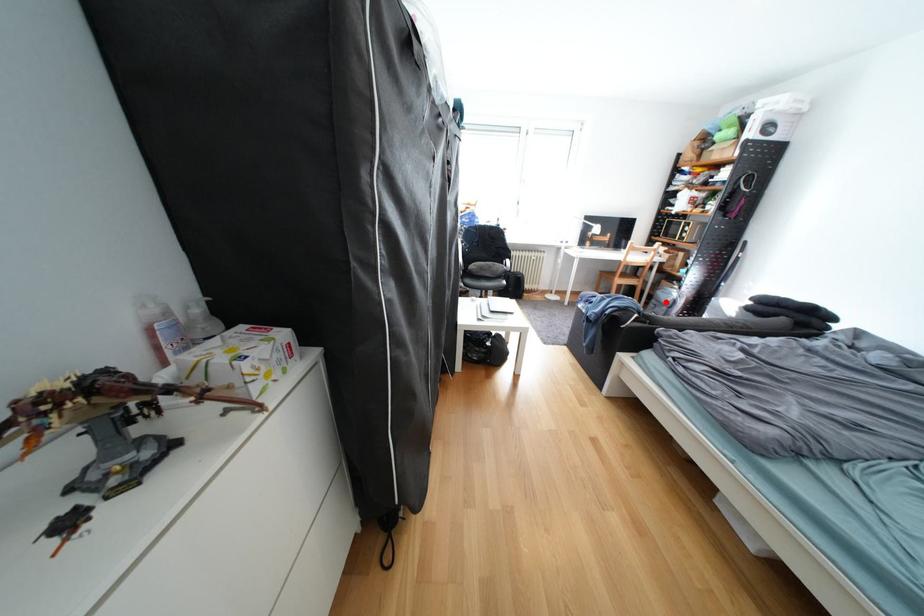
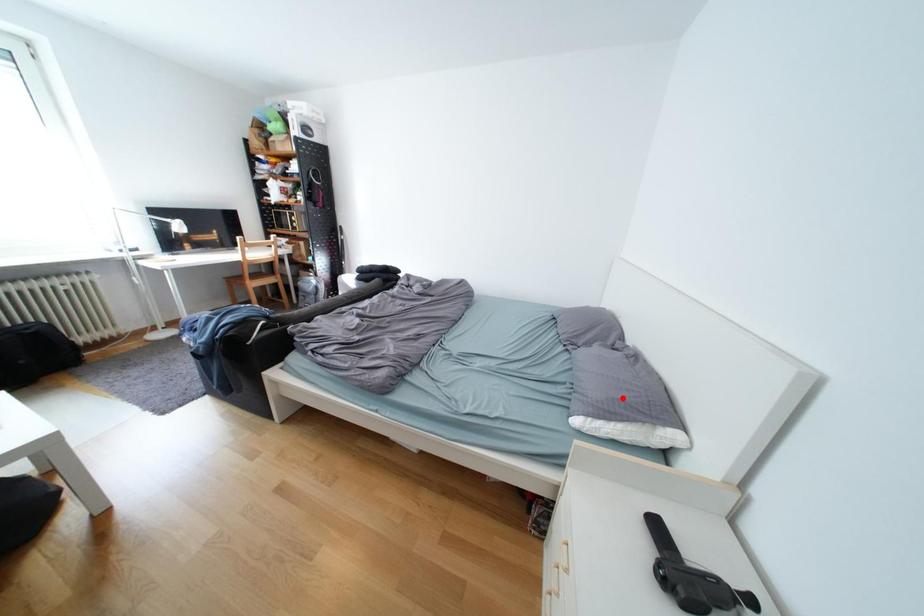
I am providing you with two images of the same scene from different viewpoints. A red point is marked on the first image and another point is marked on the second image. Is the red point in image1 aligned with the point shown in image2?

No